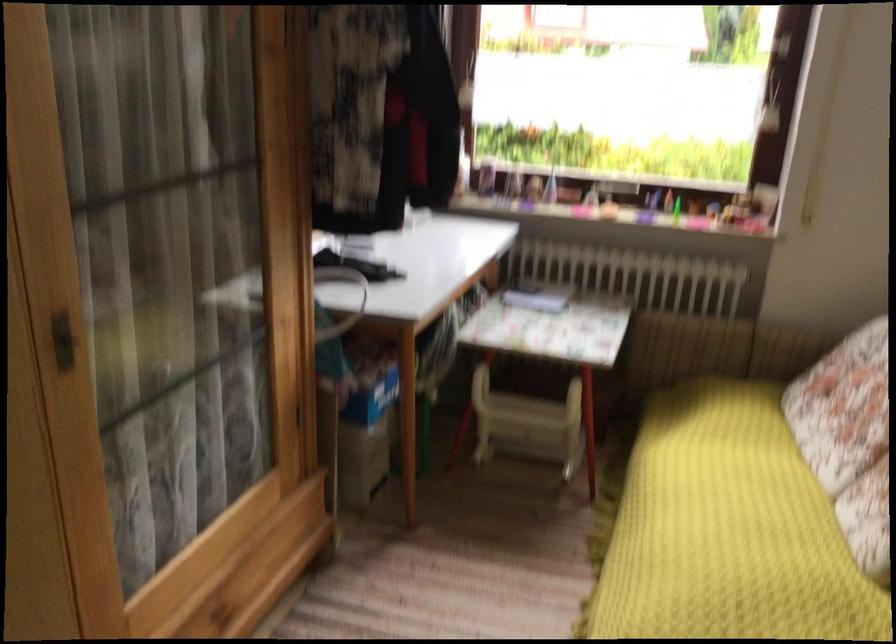
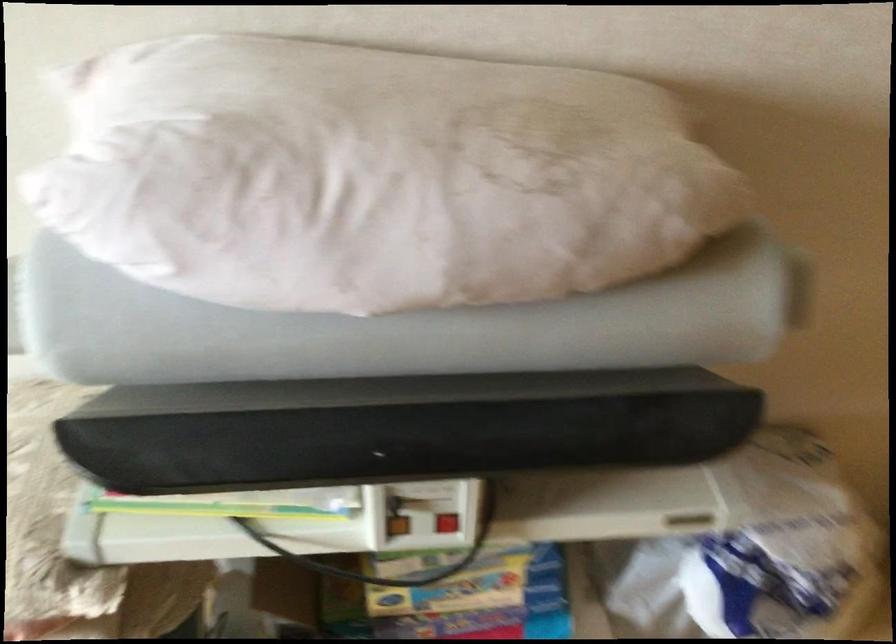
The images are taken continuously from a first-person perspective. In which direction is your viewpoint rotating?

The camera rotated toward right-down.